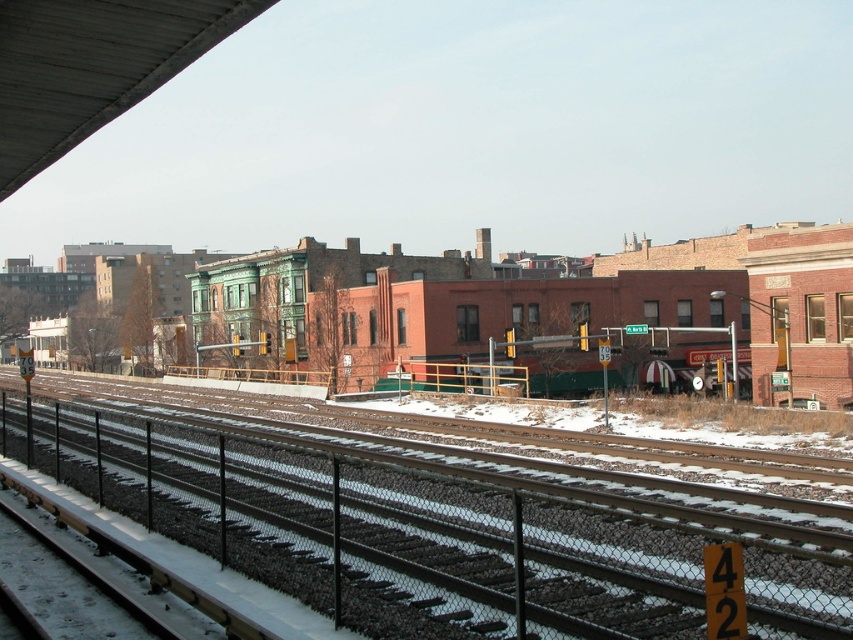
You are a photographer planning to capture the entire scene of the train station platform. You have a camera with a standard lens that can only capture objects up to the size of the metallic gray overpass at upper left. Will the smooth asphalt tracks at center fit in your frame?

The smooth asphalt tracks at center is bigger than the metallic gray overpass at upper left, so it won let the photographer capture the entire smooth asphalt tracks at center with the standard lens.